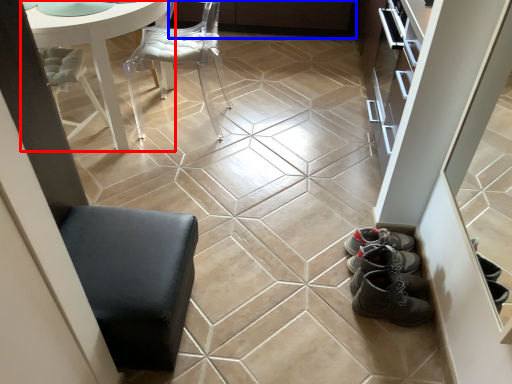
Question: Which of the following is the farthest to the observer, table (highlighted by a red box) or cabinetry (highlighted by a blue box)?

Choices:
 (A) table
 (B) cabinetry

Answer: (B)